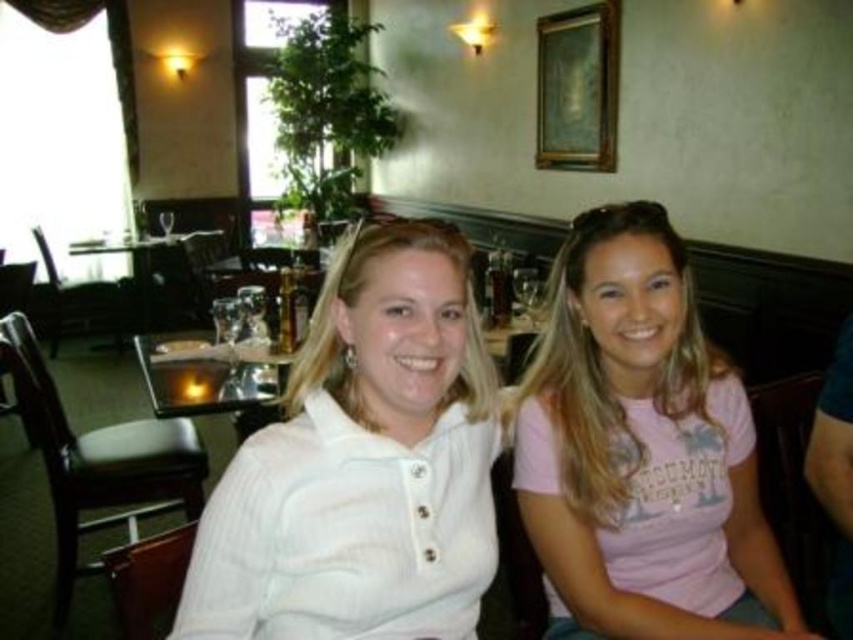
You are a photographer setting up for a portrait. You need to position a spotlight to the right of both the white ribbed polo shirt at center and the pink cotton shirt at center. Is this possible given their arrangement?

The white ribbed polo shirt at center is to the left of the pink cotton shirt at center, so placing the spotlight to the right of both is possible as they are aligned horizontally with the white ribbed polo shirt at center on the left side.

You are taking a photo of two people sitting at a table in a restaurant. You notice two points in the image labeled as point 1 and point 2. If point 1 is at coordinates point (x=196, y=592) and point 2 is at point (x=201, y=317), which point is closer to the camera?

Point 1 is closer to the camera than point 2.